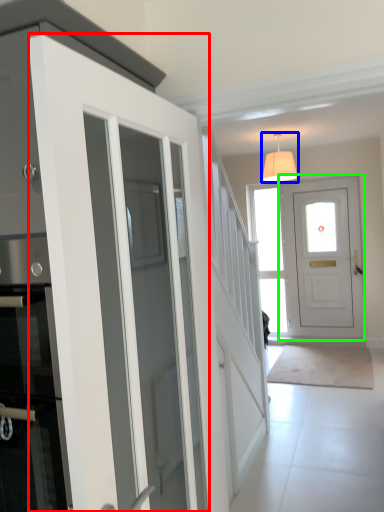
Question: Estimate the real-world distances between objects in this image. Which object is farther from door (highlighted by a red box), lamp (highlighted by a blue box) or door (highlighted by a green box)?

Choices:
 (A) lamp
 (B) door

Answer: (B)